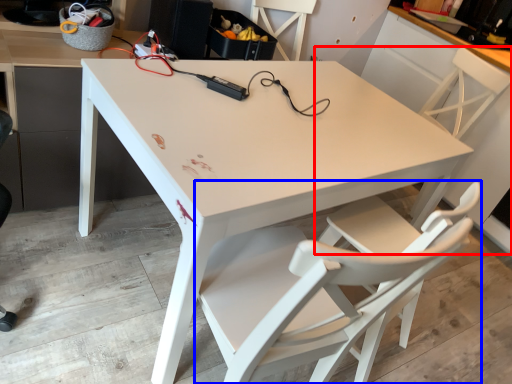
Question: Among these objects, which one is farthest to the camera, chair (highlighted by a red box) or chair (highlighted by a blue box)?

Choices:
 (A) chair
 (B) chair

Answer: (A)